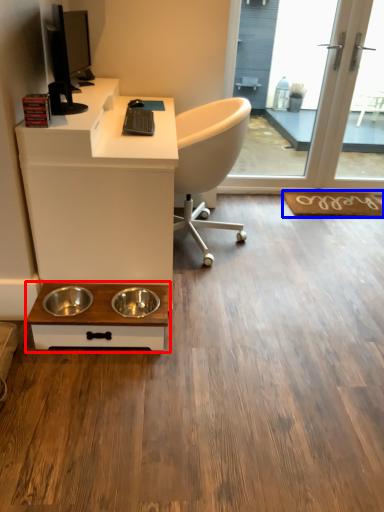
Question: Which object is further to the camera taking this photo, table (highlighted by a red box) or doormat (highlighted by a blue box)?

Choices:
 (A) table
 (B) doormat

Answer: (B)